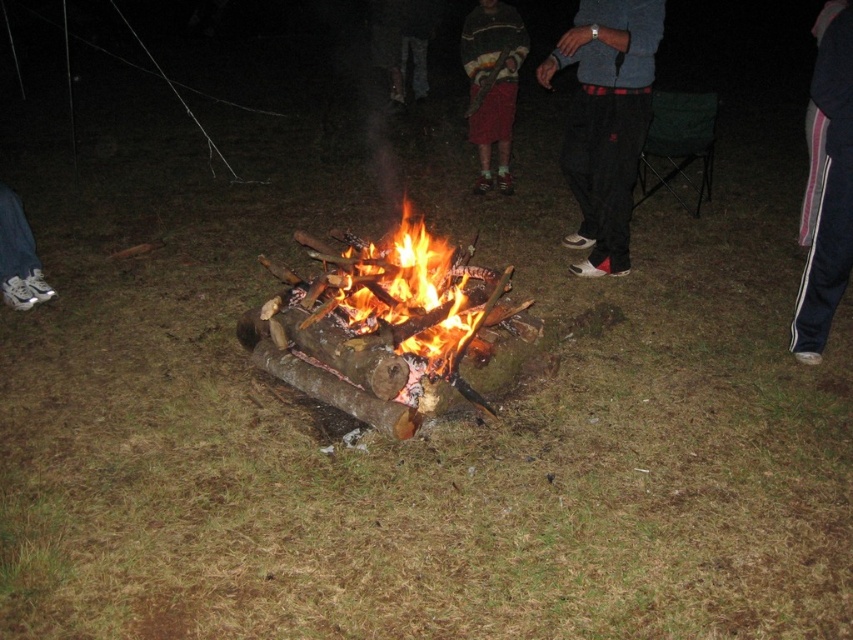
You are a photographer trying to capture the campfire scene. You notice the pink striped pants at lower right and the white sneakers at left in your frame. Which object should you adjust your camera angle to focus on if you want to highlight something taller?

The pink striped pants at lower right is much taller than the white sneakers at left, so you should adjust your camera angle to focus on the pink striped pants at lower right to highlight the taller object.

You are planning to place a small table between the knitted sweater at center and the white sneakers at left for snacks. The table requires 10 feet of space. Is there enough space between them?

The distance between the knitted sweater at center and the white sneakers at left is 12.57 feet, which is more than enough to accommodate the 10 feet required for the table.

You are standing at point (48, 296) and want to walk to the campfire. Is there an obstacle between you and point (816, 228)?

Point (816, 228) is in front of point (48, 296), so there is an obstacle between you and the campfire.